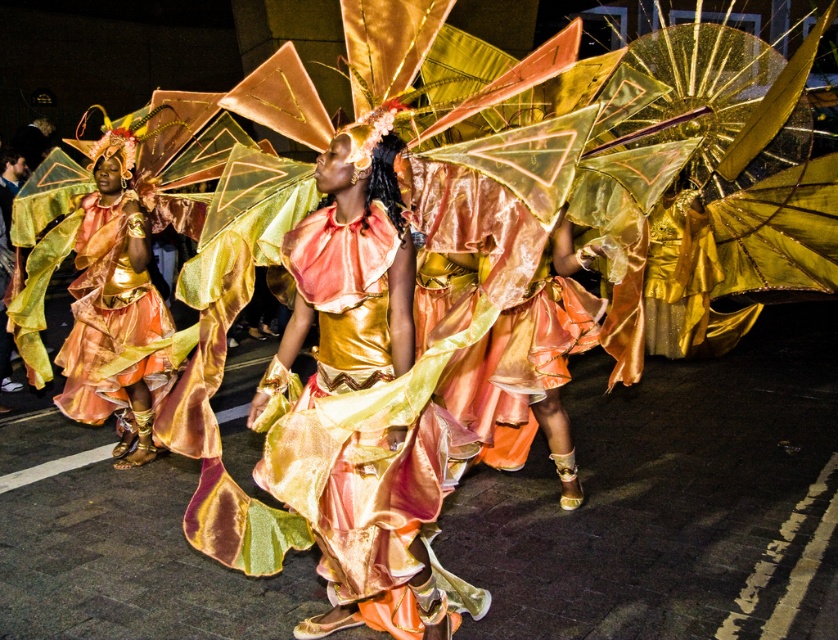
You are a photographer trying to capture the perfect shot of the shiny satin dress at center during the parade. Based on its position, where should you aim your camera to ensure the dress is centered in your frame?

To center the shiny satin dress at center in your frame, aim your camera at the coordinates point (357, 432), as that is the 2D location of the shiny satin dress at center.

You are a photographer at the parade. You want to capture both the shiny satin dress at center and the metallic gold dress at left in a single photo. The camera you have can only focus on objects within a 1.5 meter range. Will you be able to include both dresses in the photo?

The shiny satin dress at center and metallic gold dress at left are 1.66 meters apart, which is beyond the camera focus range of 1.5 meters. Therefore, you cannot include both dresses in the photo.

You are a photographer at the parade and want to capture both the shiny satin dress at center and the metallic gold dress at left in the same frame. Which dress should you focus on first if you want to ensure both are in the shot?

The shiny satin dress at center is positioned on the right side of metallic gold dress at left, so you should focus on the metallic gold dress at left first to ensure both are in the frame.